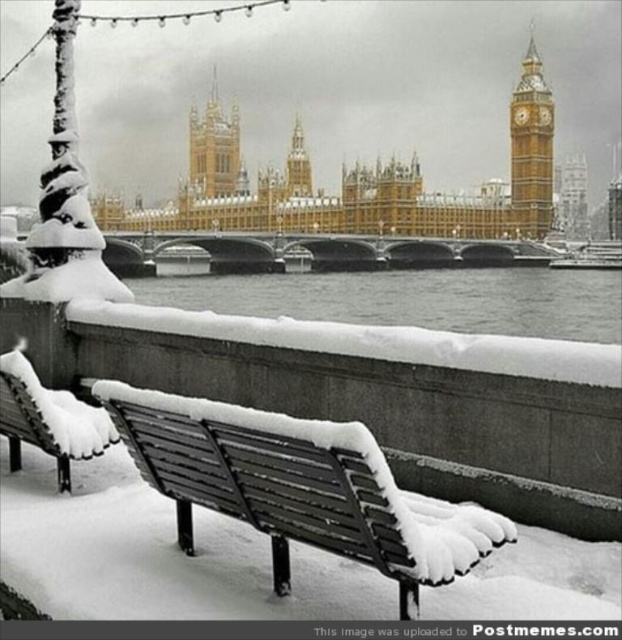
You are standing at the point marked as point (49, 419) in the image. What object is located exactly at this point?

The wooden park bench at lower left is located exactly at point (49, 419).

You are standing at the center of the image and want to take a photo of the wooden park bench at lower left. Which direction should you face to ensure the bench is in the frame?

The wooden park bench at lower left is located at point (49, 419), so you should face towards the lower left direction to include it in the frame.